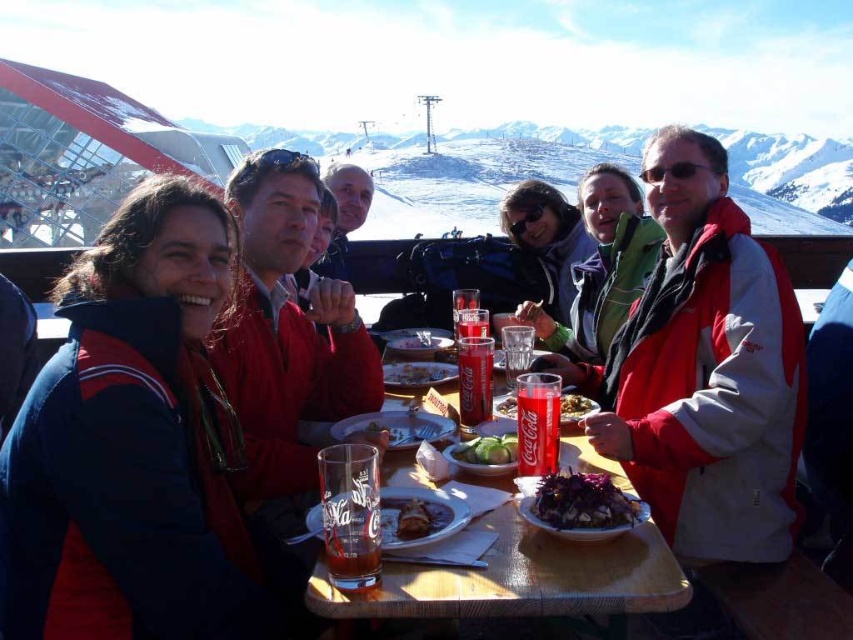
You are standing at the center of the table in the image. Looking towards the red jacket at right, which direction would you face? Please answer with either north, south, east, or west.

The question cannot be answered with the given information because the image does not provide orientation details like a compass or landmarks to determine directions such as north, south, east, or west.

You are standing at the camera position and want to hand a gift to the person wearing the red jacket at right. The gift is 2 meters long. Can you reach them without moving? Please explain.

The red jacket at right is 34.08 meters away from the camera. Since the gift is only 2 meters long, you cannot reach them without moving closer.